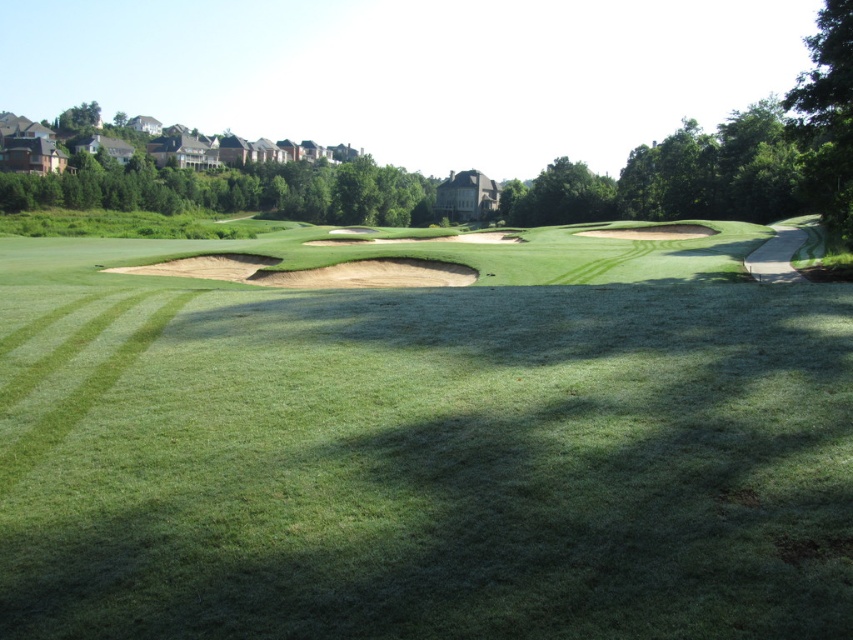
Based on the photo, does green grassy golf course at center lie behind brown sand bunker at center?

No, it is in front of brown sand bunker at center.

The width and height of the screenshot is (853, 640). I want to click on green grassy golf course at center, so click(424, 444).

Measure the distance between green grassy golf course at center and camera.

green grassy golf course at center and camera are 5.65 meters apart from each other.

Image resolution: width=853 pixels, height=640 pixels. What are the coordinates of `green grassy golf course at center` in the screenshot? It's located at (424, 444).